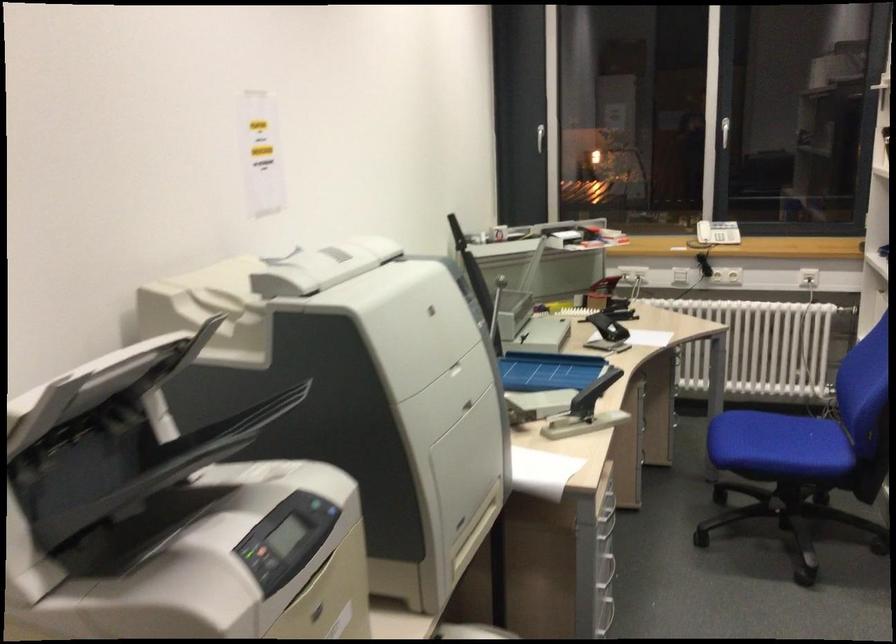
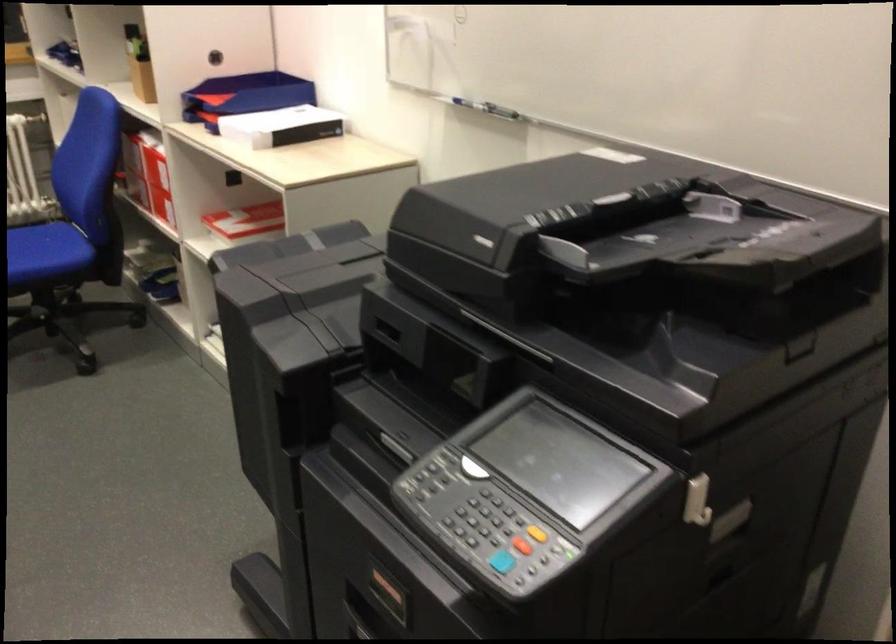
In the second image, find the point that corresponds to the point at 808,430 in the first image.

(42, 243)